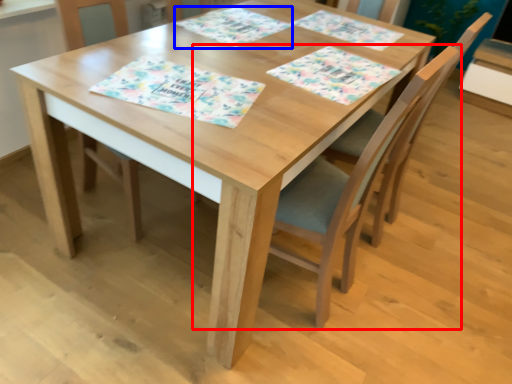
Question: Which object appears farthest to the camera in this image, chair (highlighted by a red box) or place mat (highlighted by a blue box)?

Choices:
 (A) chair
 (B) place mat

Answer: (B)